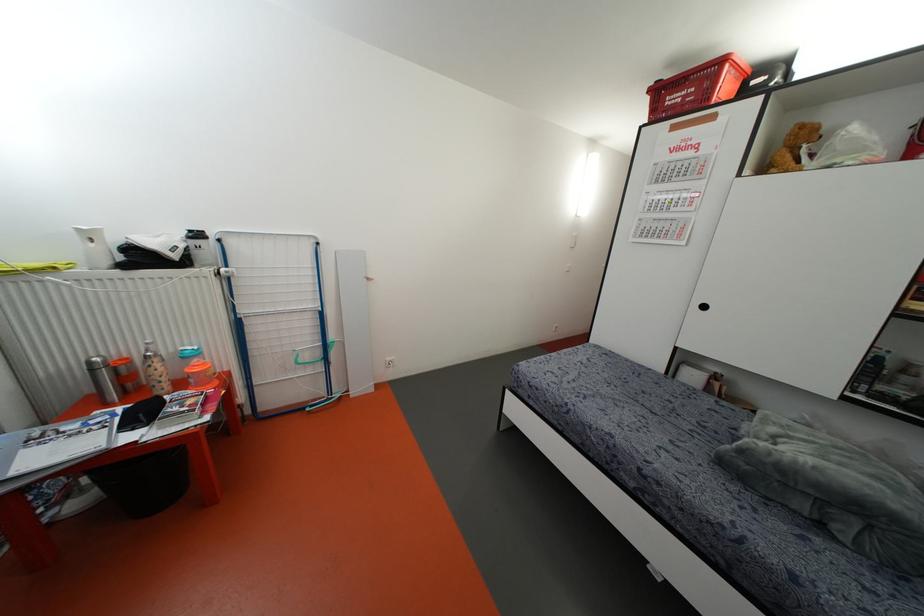
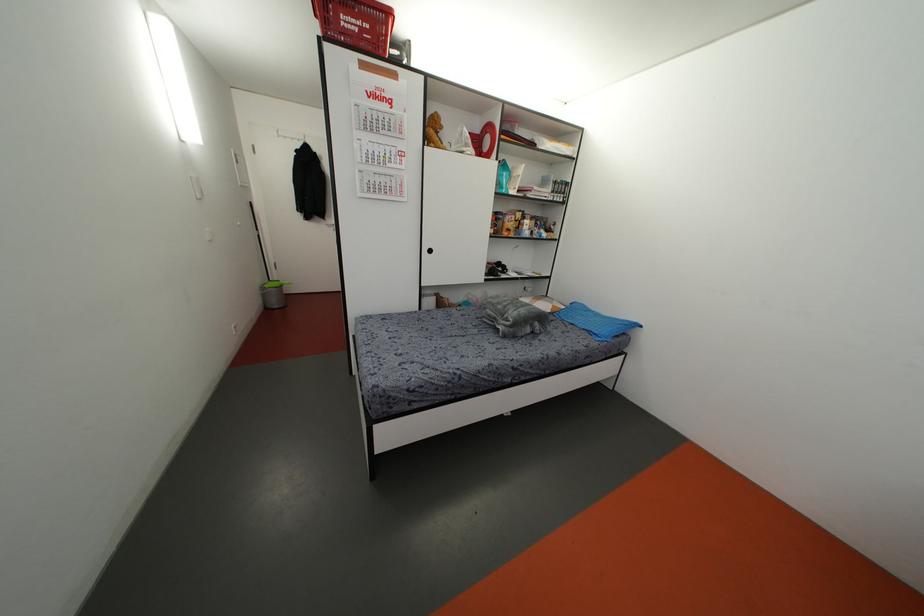
Where in the second image is the point corresponding to pixel 608 447 from the first image?

(493, 373)